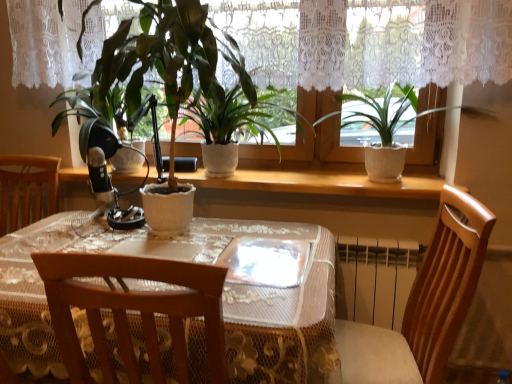
Question: Is transparent plastic plate at center inside the boundaries of white ceramic pot at center, arranged as the first houseplant when viewed from the left, or outside?

Choices:
 (A) inside
 (B) outside

Answer: (B)

Question: In the image, is transparent plastic plate at center on the left side or the right side of white ceramic pot at center, arranged as the first houseplant when viewed from the left?

Choices:
 (A) left
 (B) right

Answer: (B)

Question: Which is nearer to the wooden chair at lower right?

Choices:
 (A) transparent plastic plate at center
 (B) white ceramic pot at center, arranged as the first houseplant when viewed from the left
 (C) white lace tablecloth at center
 (D) white textured pot at upper right, which appears as the 2th houseplant when viewed from the left
 (E) white ceramic plant pot at center

Answer: (A)

Question: Estimate the real-world distances between objects in this image. Which object is closer to the wooden chair at lower right?

Choices:
 (A) white ceramic pot at center, arranged as the first houseplant when viewed from the left
 (B) transparent plastic plate at center
 (C) white textured pot at upper right, the first houseplant in the right-to-left sequence
 (D) white lace tablecloth at center
 (E) white ceramic plant pot at center

Answer: (B)